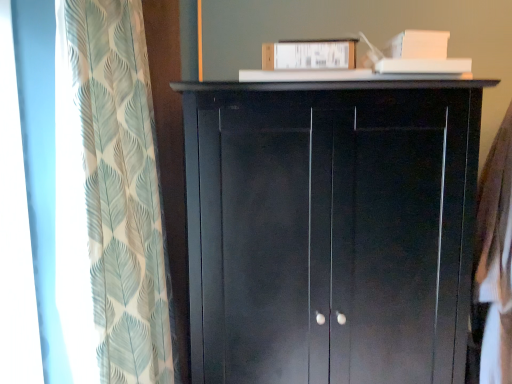
Question: Is translucent leaf-patterned curtain at left shorter than matte black cupboard at center?

Choices:
 (A) yes
 (B) no

Answer: (B)

Question: Would you say translucent leaf-patterned curtain at left is a long distance from matte black cupboard at center?

Choices:
 (A) yes
 (B) no

Answer: (B)

Question: From the image's perspective, does translucent leaf-patterned curtain at left appear lower than matte black cupboard at center?

Choices:
 (A) yes
 (B) no

Answer: (B)

Question: Is translucent leaf-patterned curtain at left not within matte black cupboard at center?

Choices:
 (A) no
 (B) yes

Answer: (B)

Question: Is translucent leaf-patterned curtain at left further to camera compared to matte black cupboard at center?

Choices:
 (A) yes
 (B) no

Answer: (B)

Question: Considering the relative sizes of translucent leaf-patterned curtain at left and matte black cupboard at center in the image provided, is translucent leaf-patterned curtain at left taller than matte black cupboard at center?

Choices:
 (A) yes
 (B) no

Answer: (A)

Question: Is translucent leaf-patterned curtain at left closer to the viewer compared to white cotton shirt at right?

Choices:
 (A) yes
 (B) no

Answer: (A)

Question: From a real-world perspective, is translucent leaf-patterned curtain at left positioned over white cotton shirt at right based on gravity?

Choices:
 (A) no
 (B) yes

Answer: (B)

Question: Does translucent leaf-patterned curtain at left have a larger size compared to white cotton shirt at right?

Choices:
 (A) no
 (B) yes

Answer: (B)

Question: Is translucent leaf-patterned curtain at left not close to white cotton shirt at right?

Choices:
 (A) yes
 (B) no

Answer: (A)

Question: Is translucent leaf-patterned curtain at left oriented towards white cotton shirt at right?

Choices:
 (A) yes
 (B) no

Answer: (A)

Question: Considering the relative sizes of translucent leaf-patterned curtain at left and white cotton shirt at right in the image provided, is translucent leaf-patterned curtain at left smaller than white cotton shirt at right?

Choices:
 (A) yes
 (B) no

Answer: (B)

Question: Is white cotton shirt at right aimed at matte black cupboard at center?

Choices:
 (A) yes
 (B) no

Answer: (A)